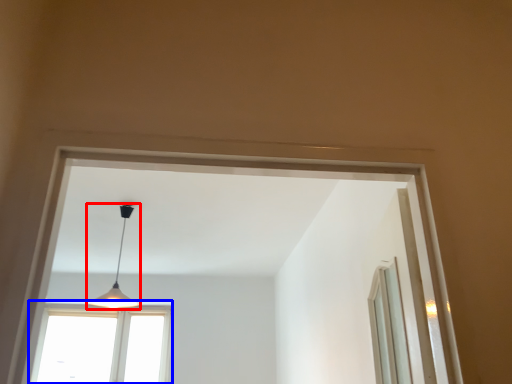
Question: Among these objects, which one is nearest to the camera, lamp (highlighted by a red box) or window (highlighted by a blue box)?

Choices:
 (A) lamp
 (B) window

Answer: (A)